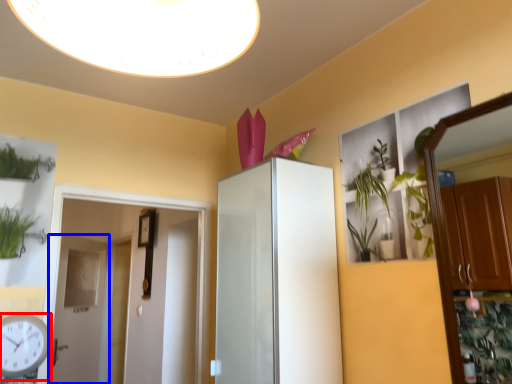
Question: Which object appears closest to the camera in this image, clock (highlighted by a red box) or door (highlighted by a blue box)?

Choices:
 (A) clock
 (B) door

Answer: (A)